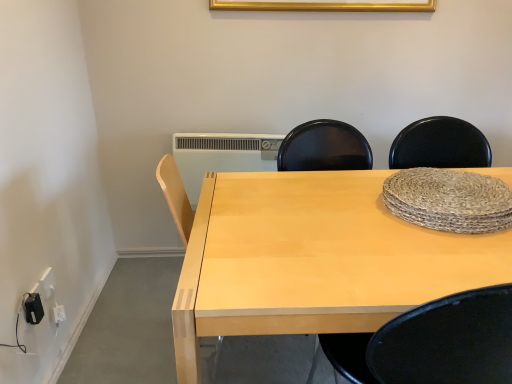
The height and width of the screenshot is (384, 512). Find the location of `free point above gold metallic picture frame at upper center (from a real-world perspective)`. free point above gold metallic picture frame at upper center (from a real-world perspective) is located at coordinates (301, 0).